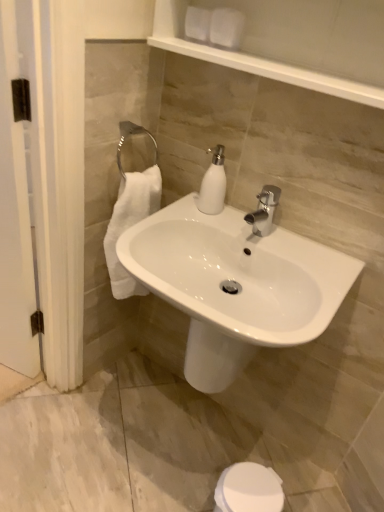
Question: Is white glossy soap dispenser at center next to white glossy sink at center?

Choices:
 (A) yes
 (B) no

Answer: (B)

Question: From a real-world perspective, is white glossy soap dispenser at center over white glossy sink at center?

Choices:
 (A) no
 (B) yes

Answer: (B)

Question: Is white glossy soap dispenser at center bigger than white glossy sink at center?

Choices:
 (A) yes
 (B) no

Answer: (B)

Question: Is white glossy soap dispenser at center smaller than white glossy sink at center?

Choices:
 (A) yes
 (B) no

Answer: (A)

Question: Does white glossy soap dispenser at center have a greater width compared to white glossy sink at center?

Choices:
 (A) no
 (B) yes

Answer: (A)

Question: In the image, is white glossy sink at center on the left side or the right side of white glossy soap dispenser at center?

Choices:
 (A) left
 (B) right

Answer: (A)

Question: Is white glossy sink at center inside the boundaries of white glossy soap dispenser at center, or outside?

Choices:
 (A) inside
 (B) outside

Answer: (B)

Question: In terms of height, does white glossy sink at center look taller or shorter compared to white glossy soap dispenser at center?

Choices:
 (A) short
 (B) tall

Answer: (B)

Question: From a real-world perspective, is white glossy sink at center positioned above or below white glossy soap dispenser at center?

Choices:
 (A) below
 (B) above

Answer: (A)

Question: Considering the positions of white matte toilet paper at upper center and white wood screen door at left in the image, is white matte toilet paper at upper center taller or shorter than white wood screen door at left?

Choices:
 (A) short
 (B) tall

Answer: (A)

Question: From the image's perspective, is white matte toilet paper at upper center positioned above or below white wood screen door at left?

Choices:
 (A) below
 (B) above

Answer: (B)

Question: In the image, is white matte toilet paper at upper center on the left side or the right side of white wood screen door at left?

Choices:
 (A) left
 (B) right

Answer: (B)

Question: Is white matte toilet paper at upper center inside or outside of white wood screen door at left?

Choices:
 (A) outside
 (B) inside

Answer: (A)

Question: Is white wood screen door at left wider or thinner than white matte toilet paper at upper center?

Choices:
 (A) thin
 (B) wide

Answer: (B)

Question: Relative to white matte toilet paper at upper center, is white wood screen door at left in front or behind?

Choices:
 (A) behind
 (B) front

Answer: (B)